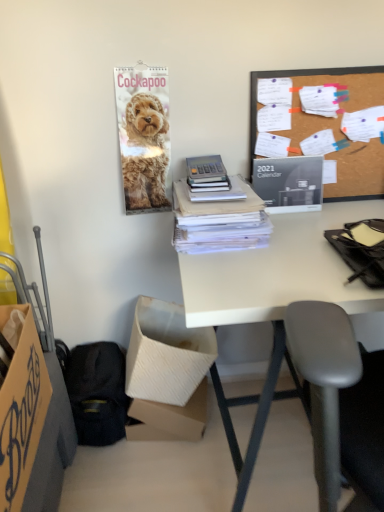
Question: Is white cardboard box at lower left, which is counted as the 2th box, starting from the front, bigger than burlap-like fabric at upper right?

Choices:
 (A) yes
 (B) no

Answer: (A)

Question: Does white cardboard box at lower left, the 2th box from the back, appear on the right side of burlap-like fabric at upper right?

Choices:
 (A) no
 (B) yes

Answer: (A)

Question: From the image's perspective, is white cardboard box at lower left, the 2th box from the back, below burlap-like fabric at upper right?

Choices:
 (A) no
 (B) yes

Answer: (B)

Question: Does white cardboard box at lower left, which is counted as the 2th box, starting from the front, have a lesser width compared to burlap-like fabric at upper right?

Choices:
 (A) no
 (B) yes

Answer: (A)

Question: Can you confirm if white cardboard box at lower left, which is counted as the 2th box, starting from the front, is smaller than burlap-like fabric at upper right?

Choices:
 (A) yes
 (B) no

Answer: (B)

Question: Does white cardboard box at lower left, the 2th box from the back, come in front of burlap-like fabric at upper right?

Choices:
 (A) yes
 (B) no

Answer: (B)

Question: Is cardboard box at lower left, the 1th box from the front, at the left side of burlap-like fabric at upper right?

Choices:
 (A) no
 (B) yes

Answer: (B)

Question: Can you confirm if cardboard box at lower left, which appears as the third box when viewed from the back, is bigger than burlap-like fabric at upper right?

Choices:
 (A) no
 (B) yes

Answer: (B)

Question: From a real-world perspective, is cardboard box at lower left, which appears as the third box when viewed from the back, on top of burlap-like fabric at upper right?

Choices:
 (A) yes
 (B) no

Answer: (B)

Question: Does cardboard box at lower left, the 1th box from the front, come behind burlap-like fabric at upper right?

Choices:
 (A) yes
 (B) no

Answer: (B)

Question: Does cardboard box at lower left, the 1th box from the front, appear on the right side of burlap-like fabric at upper right?

Choices:
 (A) no
 (B) yes

Answer: (A)

Question: Does cardboard box at lower left, the 1th box from the front, lie in front of burlap-like fabric at upper right?

Choices:
 (A) yes
 (B) no

Answer: (A)

Question: Is black fabric handbag at lower left positioned with its back to burlap-like fabric at upper right?

Choices:
 (A) yes
 (B) no

Answer: (B)